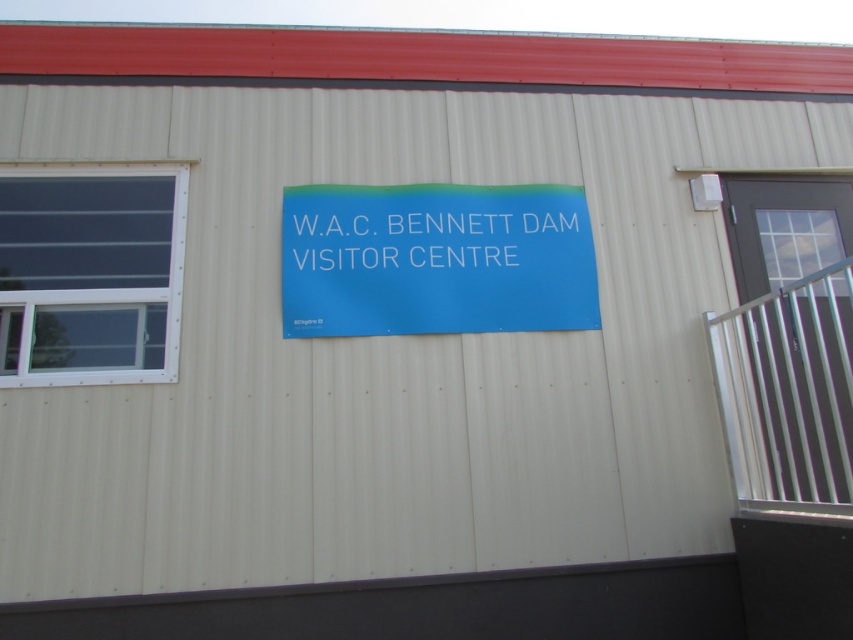
You are standing in front of the building and need to locate the entrance. Which object, the clear glass window at left or the white plastic sign at center, is taller and could help you identify the main entrance area?

The clear glass window at left is much taller than the white plastic sign at center, so the clear glass window at left is taller and could help you identify the main entrance area.

You are standing in front of the building and want to know which object is wider between the clear glass window at left and the white plastic sign at center. Which one is wider?

The white plastic sign at center is wider than the clear glass window at left.

You are a visitor approaching the building and want to read both the blue matte sign at center and the white plastic sign at center. Which sign should you look at first to ensure you can see both?

You should look at the white plastic sign at center first because the blue matte sign at center is below it, so you can see both by starting with the upper one.